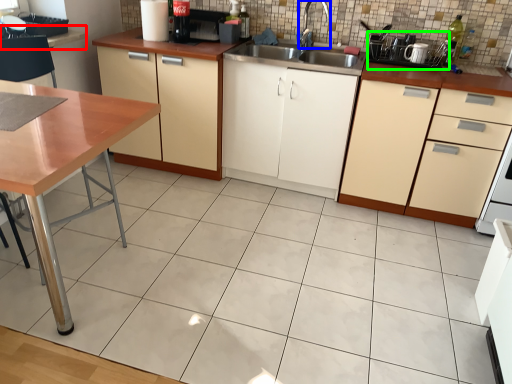
Question: Which object is the closest to the counter top (highlighted by a red box)? Choose among these: faucet (highlighted by a blue box) or appliance (highlighted by a green box).

Choices:
 (A) faucet
 (B) appliance

Answer: (A)